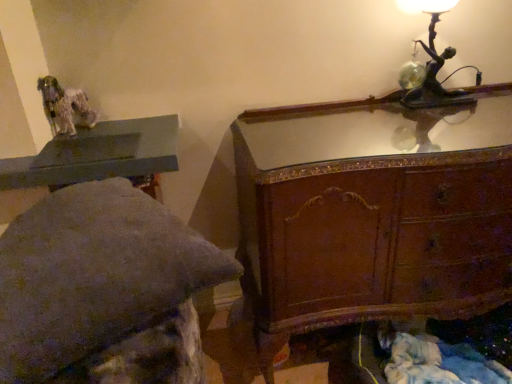
Question: Is matte gray table at upper left taller or shorter than bronze metallic table lamp at upper right?

Choices:
 (A) tall
 (B) short

Answer: (B)

Question: Considering the positions of matte gray table at upper left and bronze metallic table lamp at upper right in the image, is matte gray table at upper left wider or thinner than bronze metallic table lamp at upper right?

Choices:
 (A) thin
 (B) wide

Answer: (B)

Question: Which object is the farthest from the wooden chest of drawers at upper right?

Choices:
 (A) matte gray stone bench at upper left
 (B) matte gray table at upper left
 (C) bronze metallic table lamp at upper right

Answer: (A)

Question: Estimate the real-world distances between objects in this image. Which object is closer to the matte gray stone bench at upper left?

Choices:
 (A) matte gray table at upper left
 (B) bronze metallic table lamp at upper right
 (C) wooden chest of drawers at upper right

Answer: (A)